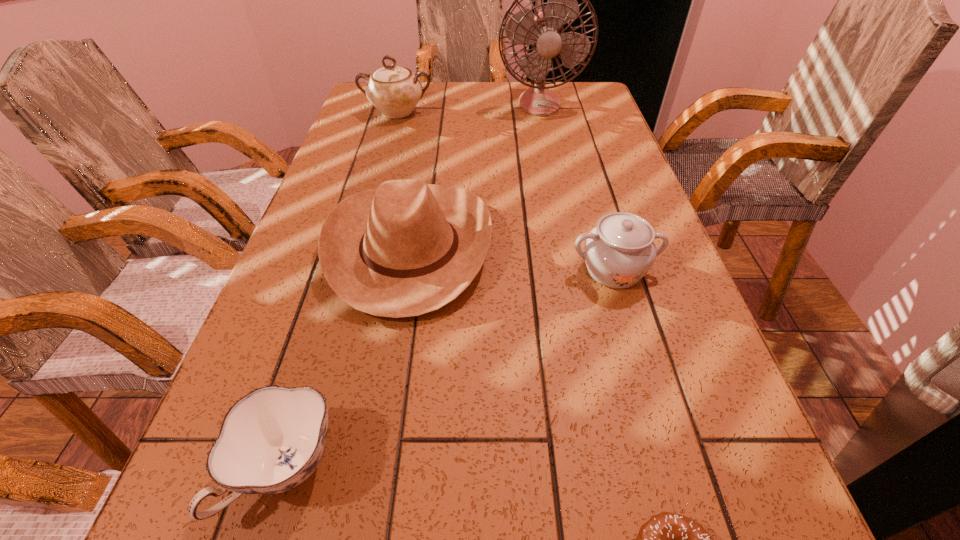
You are a GUI agent. You are given a task and a screenshot of the screen. Output one action in this format:
    pyautogui.click(x=<x>, y=<y>)
    Task: Click on the vacant space at the far right corner of the desktop
    This screenshot has height=540, width=960.
    Given the screenshot: What is the action you would take?
    [567, 94]

The width and height of the screenshot is (960, 540). Identify the location of free space between the cowboy hat and the tallest object. (474, 175).

Locate an element on the screen. This screenshot has height=540, width=960. free point between the tallest object and the cowboy hat is located at coordinates (474, 175).

You are a GUI agent. You are given a task and a screenshot of the screen. Output one action in this format:
    pyautogui.click(x=<x>, y=<y>)
    Task: Click on the free space that is in between the rightmost chinaware and the fifth tallest object
    This screenshot has width=960, height=540.
    Given the screenshot: What is the action you would take?
    click(x=449, y=370)

This screenshot has height=540, width=960. Identify the location of unoccupied position between the fan and the tallest chinaware. [x=468, y=107].

Where is `unoccupied area between the fifth tallest object and the second farthest chinaware`? The height and width of the screenshot is (540, 960). unoccupied area between the fifth tallest object and the second farthest chinaware is located at coordinates (449, 370).

The height and width of the screenshot is (540, 960). Identify the location of unoccupied position between the cowboy hat and the nearest chinaware. (348, 359).

At what (x,y) coordinates should I click in order to perform the action: click on free space that is in between the third shortest object and the fan. Please return your answer as a coordinate pair (x, y). The height and width of the screenshot is (540, 960). Looking at the image, I should click on (576, 186).

Where is `vacant point located between the fan and the rightmost chinaware`? vacant point located between the fan and the rightmost chinaware is located at coordinates (576, 186).

Locate an element on the screen. This screenshot has width=960, height=540. the fifth closest object to the cowboy hat is located at coordinates (543, 30).